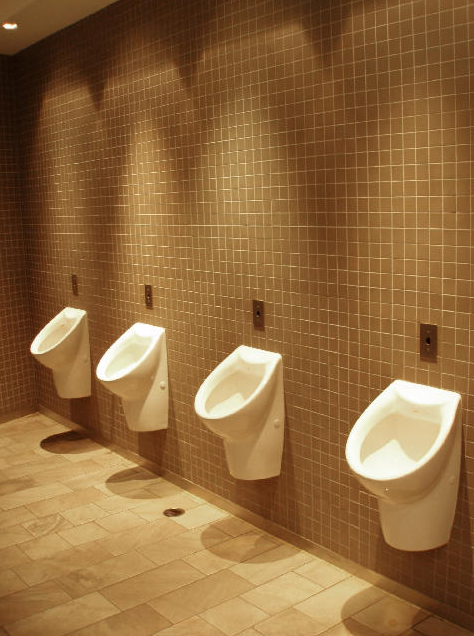
Where is `urinal`? urinal is located at coordinates (423, 429), (240, 385), (129, 347), (58, 331).